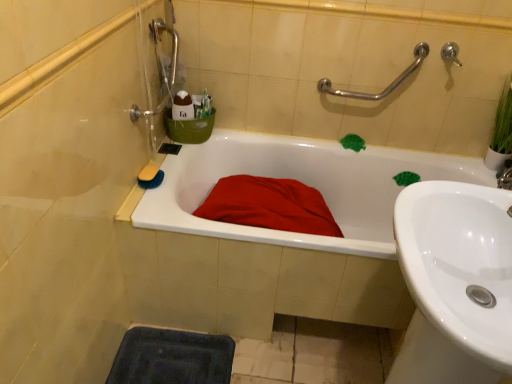
This screenshot has width=512, height=384. What are the coordinates of `vacant area on the back side of yellow sponge at upper left` in the screenshot? It's located at (163, 160).